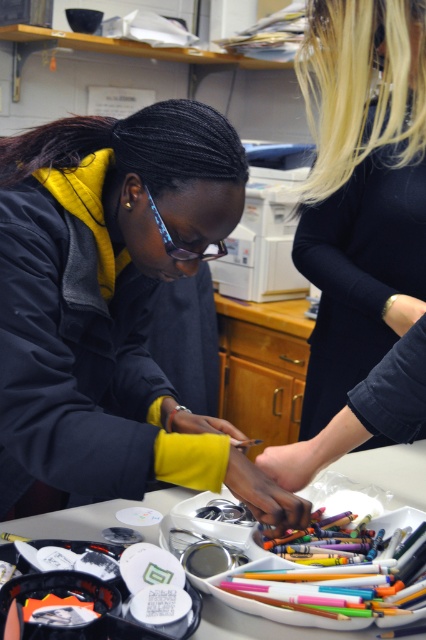
Question: Is black matte shirt at upper right above white plastic table at center?

Choices:
 (A) yes
 (B) no

Answer: (A)

Question: Which of the following is the farthest from the observer?

Choices:
 (A) white plastic table at center
 (B) black matte shirt at upper right

Answer: (B)

Question: Which of the following is the closest to the observer?

Choices:
 (A) (376, 460)
 (B) (405, 154)

Answer: (B)

Question: Can you confirm if black matte shirt at upper right is positioned above white plastic table at center?

Choices:
 (A) no
 (B) yes

Answer: (B)

Question: Which point appears farthest from the camera in this image?

Choices:
 (A) (394, 499)
 (B) (388, 323)

Answer: (B)

Question: Is black matte shirt at upper right closer to camera compared to white plastic table at center?

Choices:
 (A) no
 (B) yes

Answer: (A)